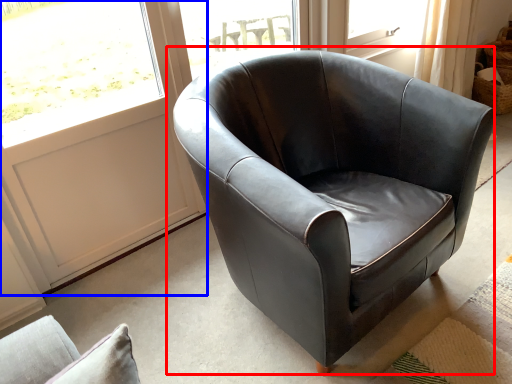
Question: Which object is further to the camera taking this photo, chair (highlighted by a red box) or screen door (highlighted by a blue box)?

Choices:
 (A) chair
 (B) screen door

Answer: (B)